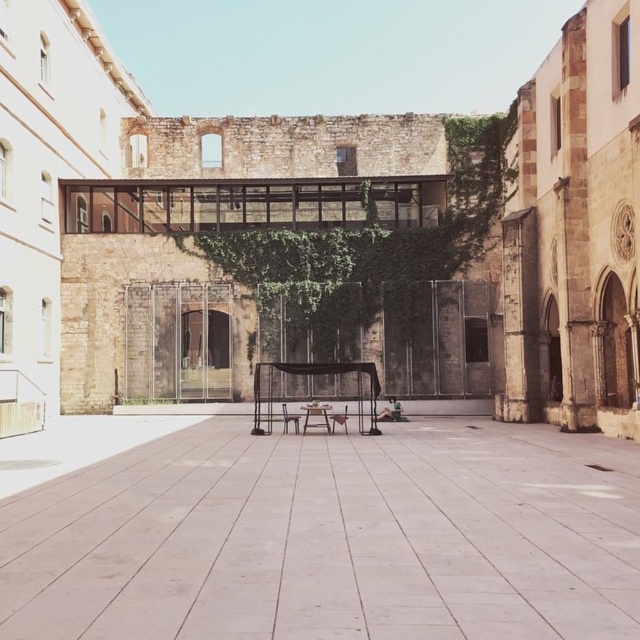
Is white concrete alley at center below wooden park bench at center?

No.

The image size is (640, 640). What do you see at coordinates (332, 538) in the screenshot? I see `white concrete alley at center` at bounding box center [332, 538].

Find the location of a particular element. The width and height of the screenshot is (640, 640). white concrete alley at center is located at coordinates (332, 538).